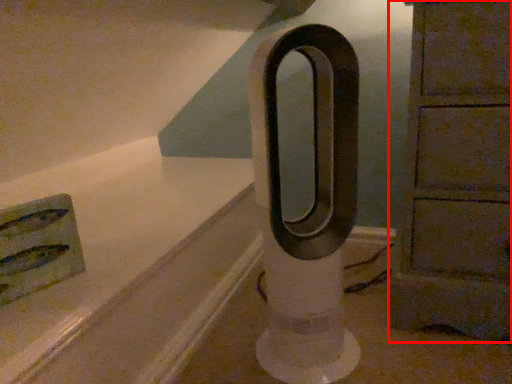
Question: Observing the image, what is the correct spatial positioning of furniture (annotated by the red box) in reference to pillar?

Choices:
 (A) right
 (B) left

Answer: (A)